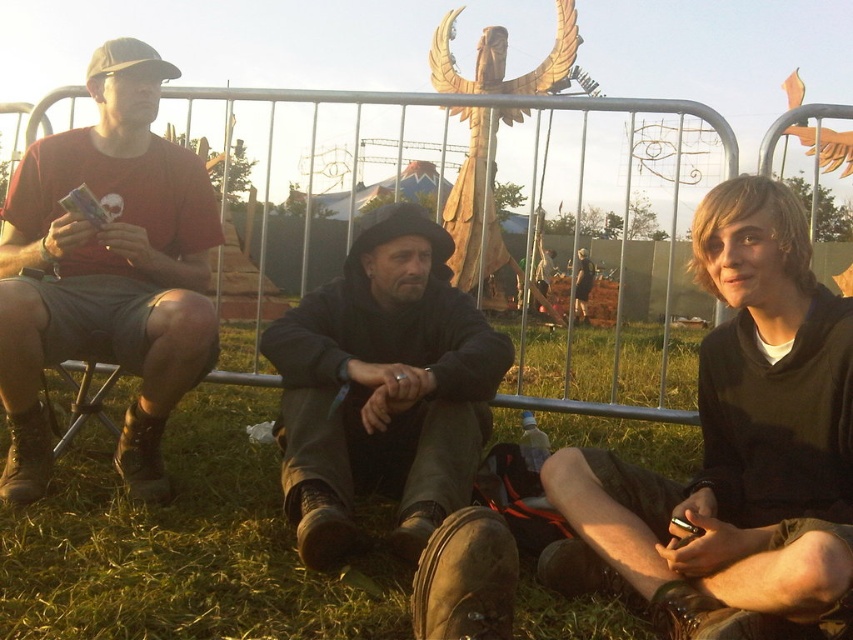
You are a photographer standing 5 feet away from the black matte hoodie at center and dark gray fabric jacket at center. Can you fit both subjects into your camera frame without moving? Explain why or why not based on their positions.

The distance between the black matte hoodie at center and dark gray fabric jacket at center is 4.99 feet, which is just under 5 feet. Since you are standing 5 feet away from both, the total width they occupy is within your camera frame. Therefore, you can fit both subjects into your frame without moving.

Where is the matte black shirt at left located?

The matte black shirt at left is located at point (106, 272).

You are trying to decide which clothing item to take from the scene. You need to choose between the black matte hoodie at center and the dark gray fabric jacket at center. Which one is located lower in the image?

The black matte hoodie at center is positioned under the dark gray fabric jacket at center, so it is lower in the image.